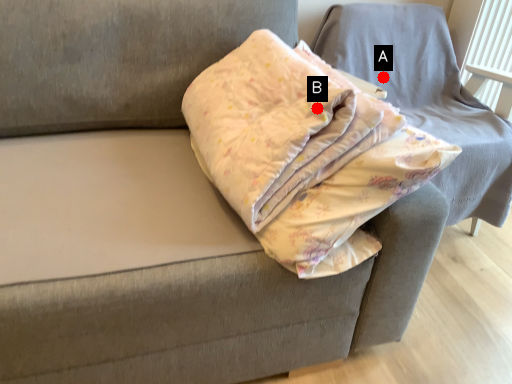
Question: Two points are circled on the image, labeled by A and B beside each circle. Which point appears closest to the camera in this image?

Choices:
 (A) A is closer
 (B) B is closer

Answer: (B)